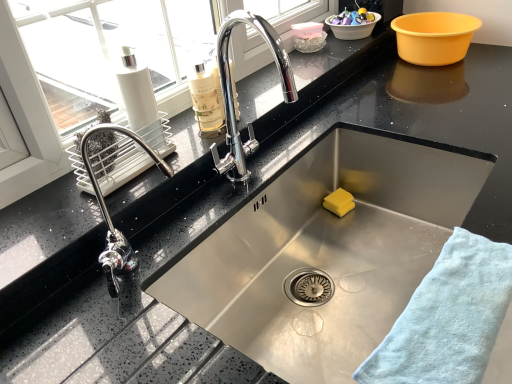
Question: Is white plastic basin at upper right, which ranks as the second basin in right-to-left order, to the left of yellow sponge at sink bottom from the viewer's perspective?

Choices:
 (A) yes
 (B) no

Answer: (B)

Question: From the image's perspective, is white plastic basin at upper right, which ranks as the second basin in right-to-left order, over yellow sponge at sink bottom?

Choices:
 (A) yes
 (B) no

Answer: (A)

Question: Is white plastic basin at upper right, the second basin viewed from the left, outside of yellow sponge at sink bottom?

Choices:
 (A) no
 (B) yes

Answer: (B)

Question: Does white plastic basin at upper right, which ranks as the second basin in right-to-left order, come behind yellow sponge at sink bottom?

Choices:
 (A) no
 (B) yes

Answer: (B)

Question: Can you confirm if white plastic basin at upper right, the second basin viewed from the left, is wider than yellow sponge at sink bottom?

Choices:
 (A) no
 (B) yes

Answer: (B)

Question: From the image's perspective, relative to light blue cotton towel at lower right, is yellow plastic basin at upper right, acting as the 3th basin starting from the left, above or below?

Choices:
 (A) below
 (B) above

Answer: (B)

Question: Is yellow plastic basin at upper right, which is counted as the 1th basin, starting from the right, bigger or smaller than light blue cotton towel at lower right?

Choices:
 (A) small
 (B) big

Answer: (B)

Question: Would you say yellow plastic basin at upper right, which is counted as the 1th basin, starting from the right, is to the left or to the right of light blue cotton towel at lower right in the picture?

Choices:
 (A) right
 (B) left

Answer: (A)

Question: Is point (445, 59) closer or farther from the camera than point (429, 360)?

Choices:
 (A) farther
 (B) closer

Answer: (A)

Question: From a real-world perspective, is light blue cotton towel at lower right above or below yellow sponge at sink bottom?

Choices:
 (A) below
 (B) above

Answer: (B)

Question: Is light blue cotton towel at lower right to the left or to the right of yellow sponge at sink bottom in the image?

Choices:
 (A) left
 (B) right

Answer: (B)

Question: Is light blue cotton towel at lower right inside the boundaries of yellow sponge at sink bottom, or outside?

Choices:
 (A) inside
 (B) outside

Answer: (B)

Question: From the image's perspective, is light blue cotton towel at lower right positioned above or below yellow sponge at sink bottom?

Choices:
 (A) below
 (B) above

Answer: (A)

Question: In terms of size, does yellow sponge at sink bottom appear bigger or smaller than translucent plastic container at upper center, which is the 1th basin in left-to-right order?

Choices:
 (A) small
 (B) big

Answer: (B)

Question: Would you say yellow sponge at sink bottom is inside or outside translucent plastic container at upper center, which is the 1th basin in left-to-right order?

Choices:
 (A) outside
 (B) inside

Answer: (A)